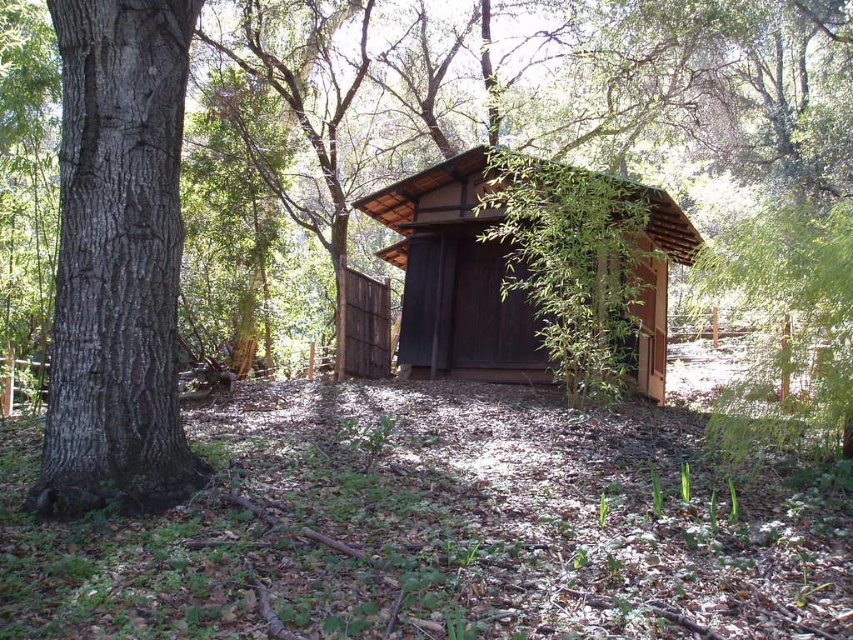
Who is positioned more to the right, smooth brown bark at left or brown wooden cabin at center?

brown wooden cabin at center is more to the right.

Between smooth brown bark at left and brown wooden cabin at center, which one is positioned lower?

Positioned lower is brown wooden cabin at center.

Locate an element on the screen. The width and height of the screenshot is (853, 640). smooth brown bark at left is located at coordinates (117, 260).